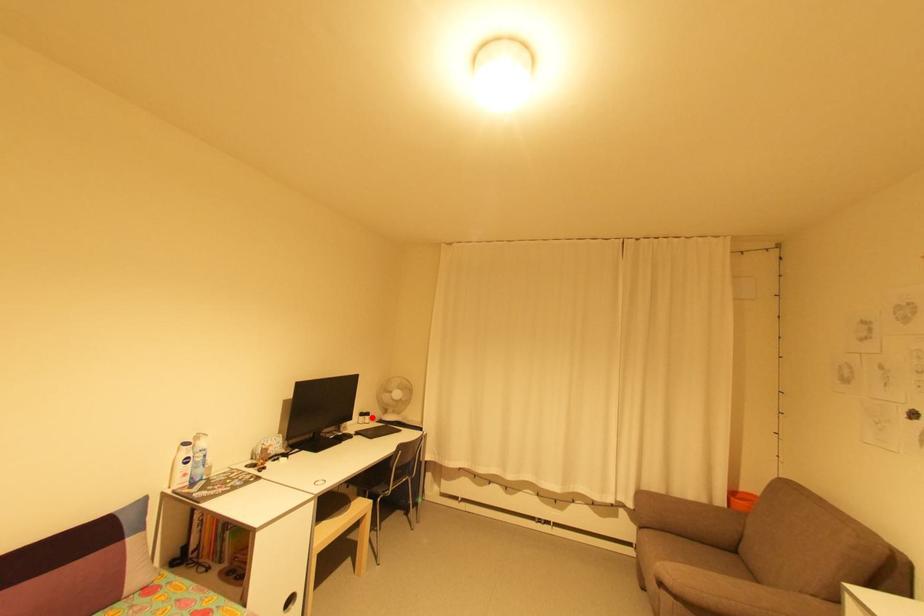
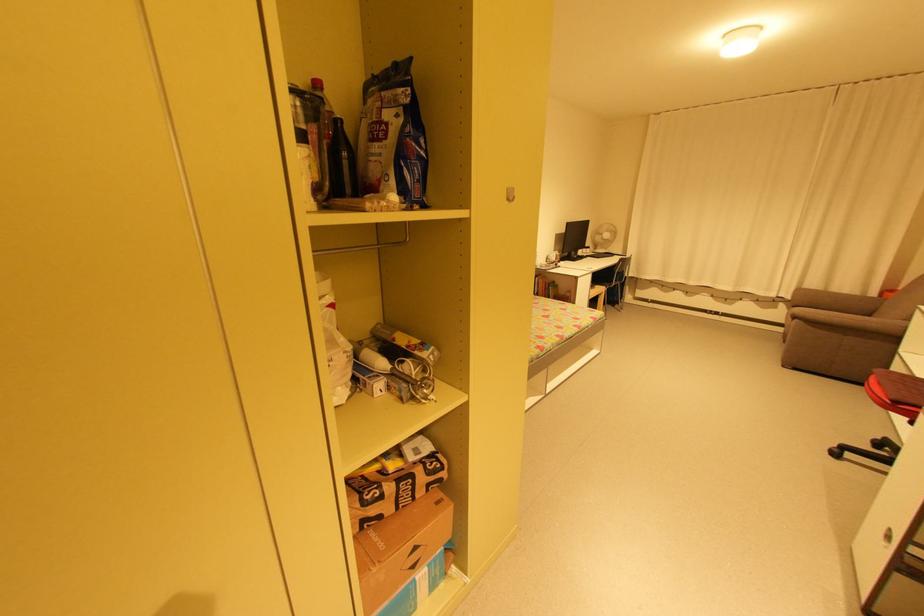
Question: A red point is marked in image1. In image2, is the corresponding 3D point closer to the camera or farther? Reply with the corresponding letter.

Choices:
 (A) The corresponding 3D point is closer.
 (B) The corresponding 3D point is farther.

Answer: (A)